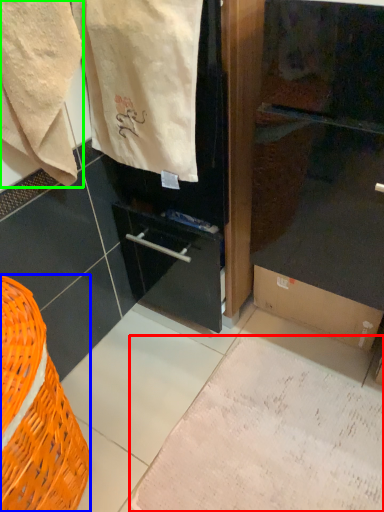
Question: Estimate the real-world distances between objects in this image. Which object is closer to parchment (highlighted by a red box), basket (highlighted by a blue box) or towel (highlighted by a green box)?

Choices:
 (A) basket
 (B) towel

Answer: (A)